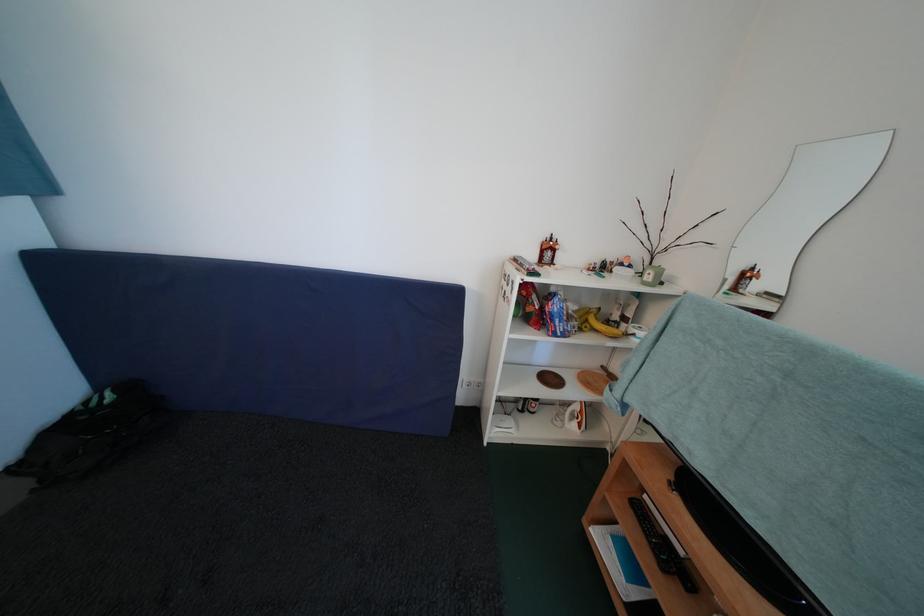
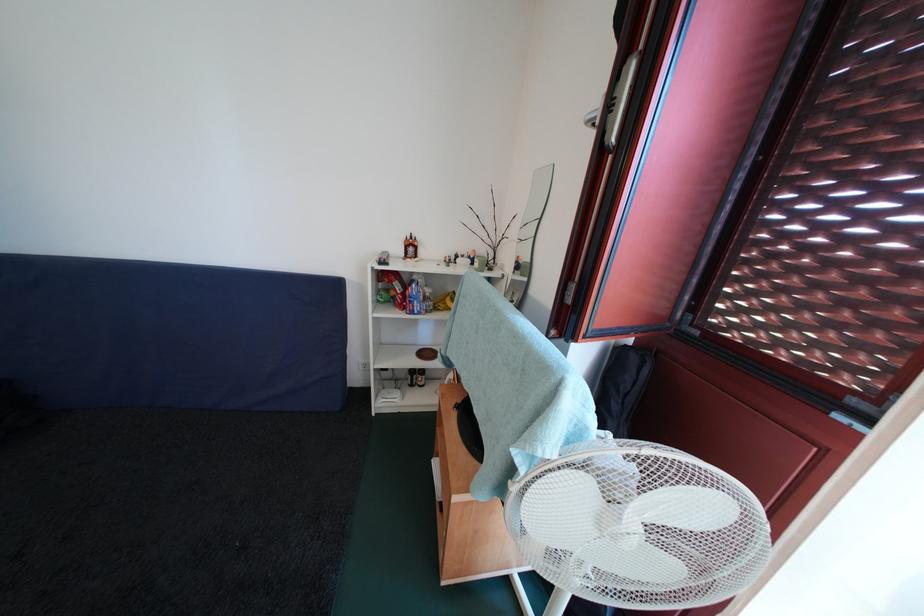
The point at (556,384) is marked in the first image. Where is the corresponding point in the second image?

(433, 359)